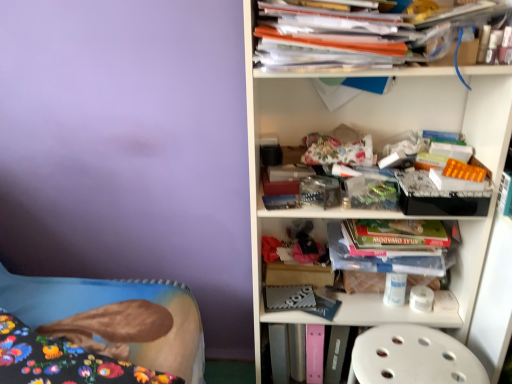
Image resolution: width=512 pixels, height=384 pixels. I want to click on blank space above white plastic step stool at lower right (from a real-world perspective), so click(x=405, y=351).